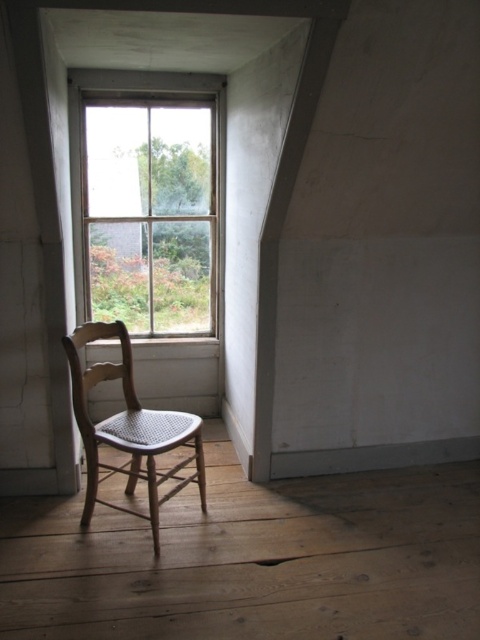
Question: In this image, where is clear glass window at center located relative to light wood cane chair at left?

Choices:
 (A) left
 (B) right

Answer: (A)

Question: Can you confirm if clear glass window at center is bigger than light wood cane chair at left?

Choices:
 (A) no
 (B) yes

Answer: (B)

Question: Does clear glass window at center appear on the left side of light wood cane chair at left?

Choices:
 (A) yes
 (B) no

Answer: (A)

Question: Which object appears farthest from the camera in this image?

Choices:
 (A) clear glass window at center
 (B) light wood cane chair at left

Answer: (A)